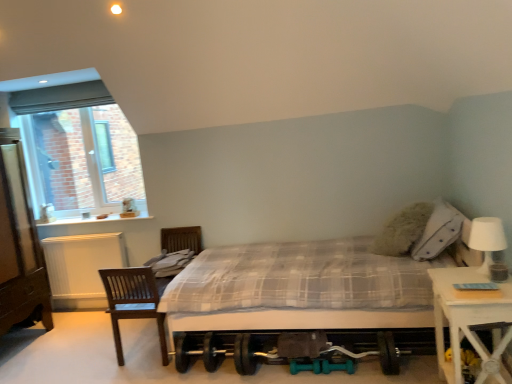
Question: Are white plastic window at upper left and white matte table lamp at right far apart?

Choices:
 (A) yes
 (B) no

Answer: (A)

Question: Would you say white matte table lamp at right is part of white plastic window at upper left's contents?

Choices:
 (A) yes
 (B) no

Answer: (B)

Question: Is white plastic window at upper left to the left of white matte table lamp at right from the viewer's perspective?

Choices:
 (A) yes
 (B) no

Answer: (A)

Question: Can you see white plastic window at upper left touching white matte table lamp at right?

Choices:
 (A) yes
 (B) no

Answer: (B)

Question: Does white plastic window at upper left turn towards white matte table lamp at right?

Choices:
 (A) no
 (B) yes

Answer: (A)

Question: Considering their positions, is brown wooden dresser at left located in front of or behind white plastic window at upper left?

Choices:
 (A) front
 (B) behind

Answer: (A)

Question: In terms of height, does brown wooden dresser at left look taller or shorter compared to white plastic window at upper left?

Choices:
 (A) tall
 (B) short

Answer: (A)

Question: Would you say brown wooden dresser at left is inside or outside white plastic window at upper left?

Choices:
 (A) outside
 (B) inside

Answer: (A)

Question: Is brown wooden dresser at left wider or thinner than white plastic window at upper left?

Choices:
 (A) thin
 (B) wide

Answer: (B)

Question: Based on their sizes in the image, would you say white plastic window at upper left is bigger or smaller than white wood nightstand at right?

Choices:
 (A) big
 (B) small

Answer: (A)

Question: From a real-world perspective, relative to white wood nightstand at right, is white plastic window at upper left vertically above or below?

Choices:
 (A) above
 (B) below

Answer: (A)

Question: Is white plastic window at upper left taller or shorter than white wood nightstand at right?

Choices:
 (A) short
 (B) tall

Answer: (B)

Question: Do you think white plastic window at upper left is within white wood nightstand at right, or outside of it?

Choices:
 (A) outside
 (B) inside

Answer: (A)

Question: From their relative heights in the image, would you say white matte table lamp at right is taller or shorter than white plastic window at upper left?

Choices:
 (A) tall
 (B) short

Answer: (B)

Question: Considering their positions, is white matte table lamp at right located in front of or behind white plastic window at upper left?

Choices:
 (A) front
 (B) behind

Answer: (A)